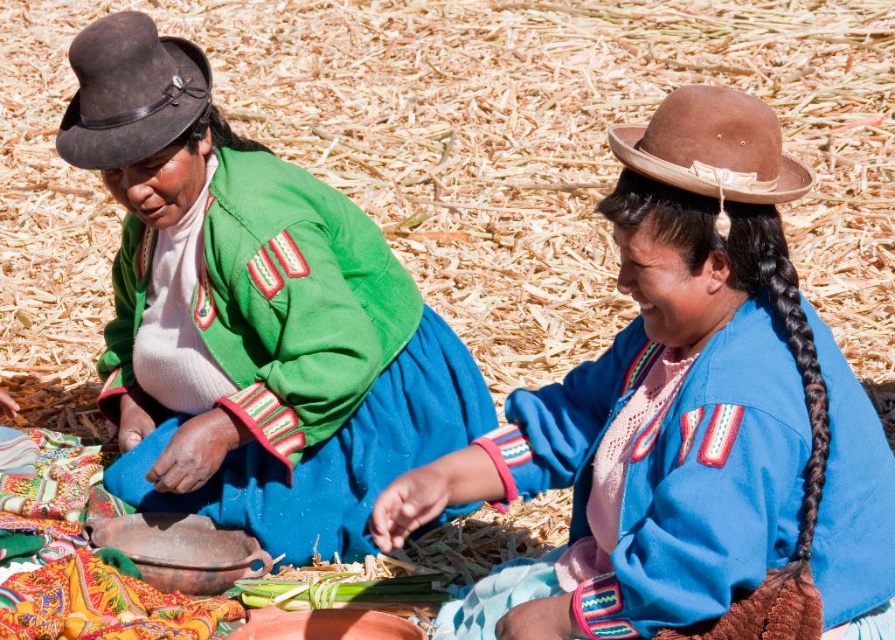
Question: Can you confirm if blue woven fabric at center is positioned above dark brown suede hat at upper left?

Choices:
 (A) yes
 (B) no

Answer: (B)

Question: Considering the relative positions of brown straw at center and blue woven fabric at center in the image provided, where is brown straw at center located with respect to blue woven fabric at center?

Choices:
 (A) above
 (B) below

Answer: (A)

Question: Which object is positioned farthest from the green woven fabric at left?

Choices:
 (A) brown suede cowboy hat at upper right
 (B) blue woven fabric at center
 (C) black silky hair at right
 (D) brown straw at center

Answer: (D)

Question: Based on their relative distances, which object is nearer to the brown suede cowboy hat at upper right?

Choices:
 (A) blue woven fabric at center
 (B) brown straw at center
 (C) black silky hair at right
 (D) green woven fabric at left

Answer: (C)

Question: Can you confirm if blue woven fabric at center is positioned to the right of green woven fabric at left?

Choices:
 (A) no
 (B) yes

Answer: (B)

Question: Which point is farther to the camera?

Choices:
 (A) (725, 157)
 (B) (305, 342)

Answer: (B)